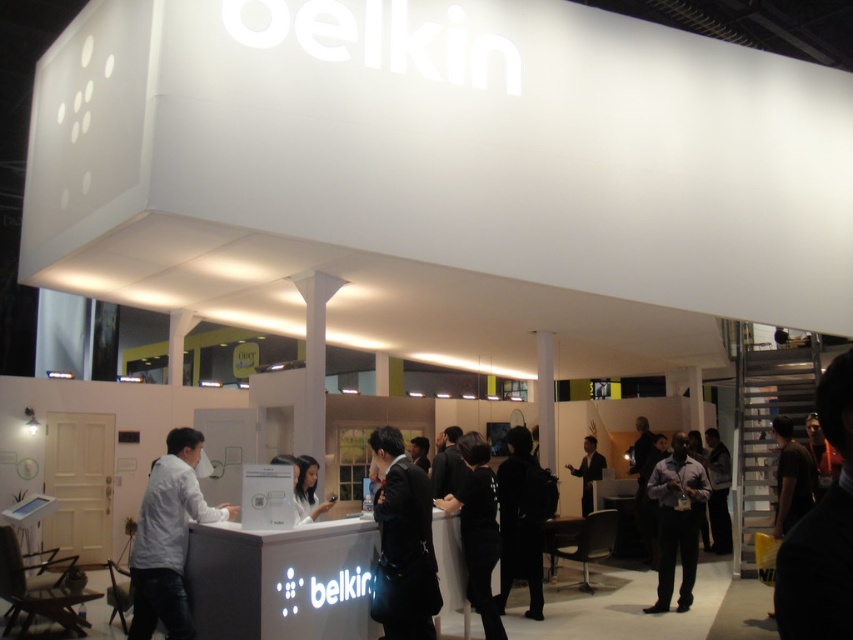
Between black leather jacket at center and dark gray fabric jacket at lower right, which one has more height?

dark gray fabric jacket at lower right

Who is more forward, (415, 509) or (717, 531)?

Point (415, 509)

Between point (404, 502) and point (708, 509), which one is positioned behind?

Point (708, 509)

The image size is (853, 640). Find the location of `black leather jacket at center`. black leather jacket at center is located at coordinates (405, 540).

Looking at this image, between white matte shirt at left and dark gray fabric jacket at lower right, which one appears on the left side from the viewer's perspective?

Positioned to the left is white matte shirt at left.

Who is taller, white matte shirt at left or dark gray fabric jacket at lower right?

Standing taller between the two is dark gray fabric jacket at lower right.

You are a GUI agent. You are given a task and a screenshot of the screen. Output one action in this format:
    pyautogui.click(x=<x>, y=<y>)
    Task: Click on the white matte shirt at left
    
    Given the screenshot: What is the action you would take?
    pyautogui.click(x=167, y=538)

The width and height of the screenshot is (853, 640). What are the coordinates of `white matte shirt at left` in the screenshot? It's located at (167, 538).

Can you confirm if matte black shirt at center is shorter than white glossy phone at center?

Incorrect, matte black shirt at center's height does not fall short of white glossy phone at center's.

Is matte black shirt at center above white glossy phone at center?

No.

Is point (660, 465) more distant than point (325, 508)?

Yes, it is behind point (325, 508).

The width and height of the screenshot is (853, 640). I want to click on matte black shirt at center, so click(x=676, y=520).